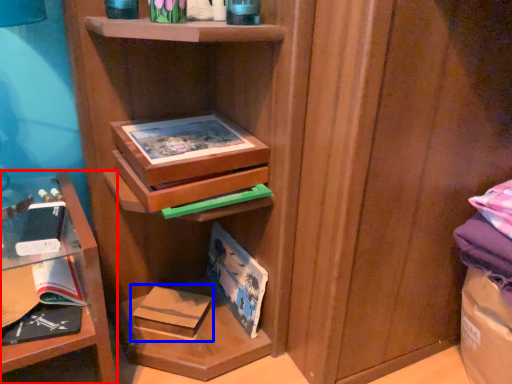
Question: Among these objects, which one is nearest to the camera, shelf (highlighted by a red box) or paperback book (highlighted by a blue box)?

Choices:
 (A) shelf
 (B) paperback book

Answer: (A)